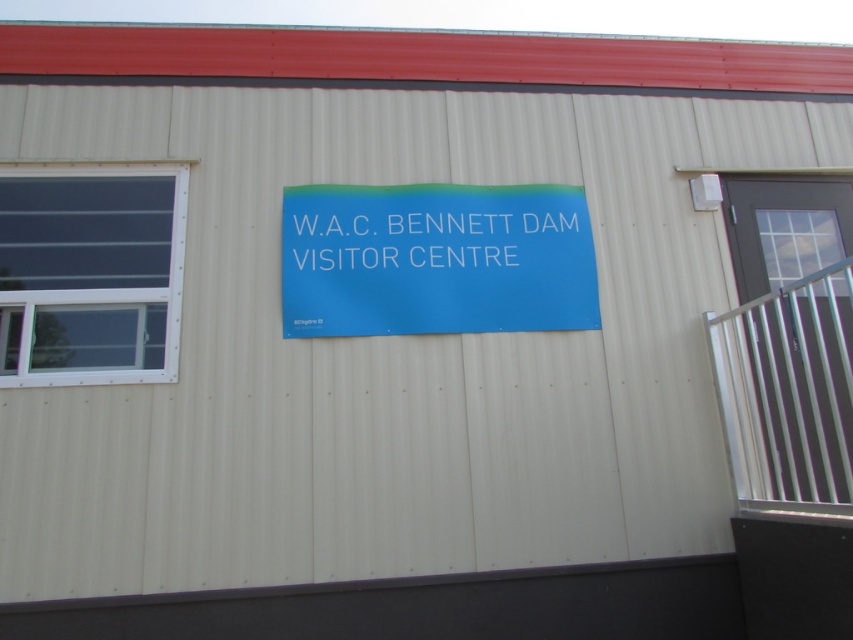
Question: Which point is closer to the camera?

Choices:
 (A) clear glass window at left
 (B) white plastic sign at center

Answer: (A)

Question: Which object appears closest to the camera in this image?

Choices:
 (A) white plastic sign at center
 (B) blue matte sign at center

Answer: (B)

Question: Is clear glass window at left to the right of white plastic sign at center from the viewer's perspective?

Choices:
 (A) no
 (B) yes

Answer: (A)

Question: Considering the relative positions of blue matte sign at center and clear glass window at left in the image provided, where is blue matte sign at center located with respect to clear glass window at left?

Choices:
 (A) below
 (B) above

Answer: (B)

Question: Where is clear glass window at left located in relation to white plastic sign at center in the image?

Choices:
 (A) right
 (B) left

Answer: (B)

Question: Estimate the real-world distances between objects in this image. Which object is closer to the blue matte sign at center?

Choices:
 (A) clear glass window at left
 (B) white plastic sign at center

Answer: (B)